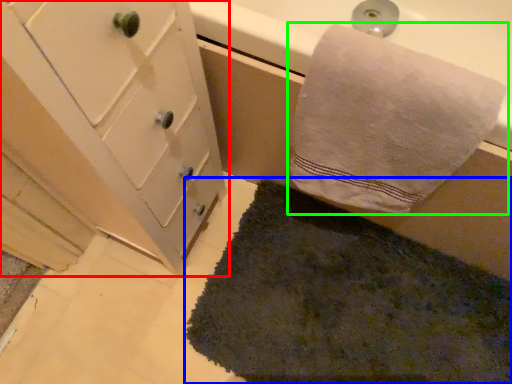
Question: Estimate the real-world distances between objects in this image. Which object is farther from bathroom cabinet (highlighted by a red box), bath mat (highlighted by a blue box) or towel (highlighted by a green box)?

Choices:
 (A) bath mat
 (B) towel

Answer: (A)